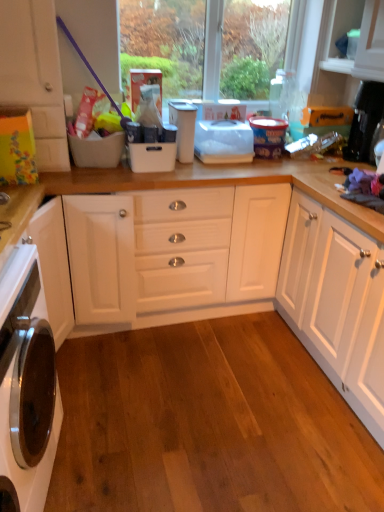
Find the location of `vacant space behind white glossy oven at lower left`. vacant space behind white glossy oven at lower left is located at coordinates (107, 391).